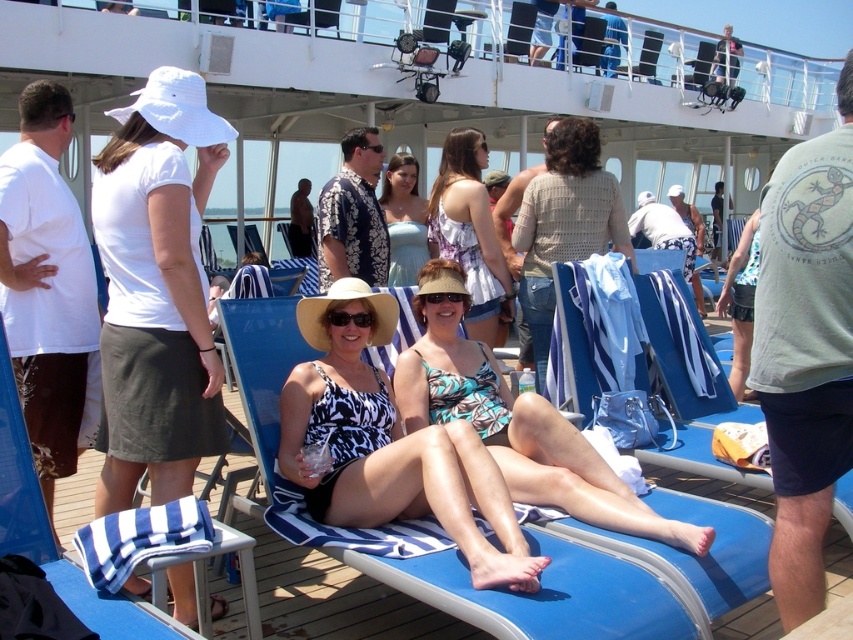
Question: Does white cotton hat at upper left have a greater width compared to light blue satin dress at center?

Choices:
 (A) no
 (B) yes

Answer: (B)

Question: Which point appears closest to the camera in this image?

Choices:
 (A) (395, 221)
 (B) (496, 392)
 (C) (392, 440)
 (D) (473, 262)

Answer: (C)

Question: Considering the relative positions of white cotton hat at upper left and light blue satin dress at center in the image provided, where is white cotton hat at upper left located with respect to light blue satin dress at center?

Choices:
 (A) above
 (B) below

Answer: (B)

Question: Which point appears closest to the camera in this image?

Choices:
 (A) (103, 493)
 (B) (488, 212)

Answer: (A)

Question: Which point is closer to the camera?

Choices:
 (A) light blue satin dress at center
 (B) white cotton hat at upper left

Answer: (B)

Question: Can you confirm if printed fabric swimsuit at center is wider than printed fabric tank top at center?

Choices:
 (A) yes
 (B) no

Answer: (A)